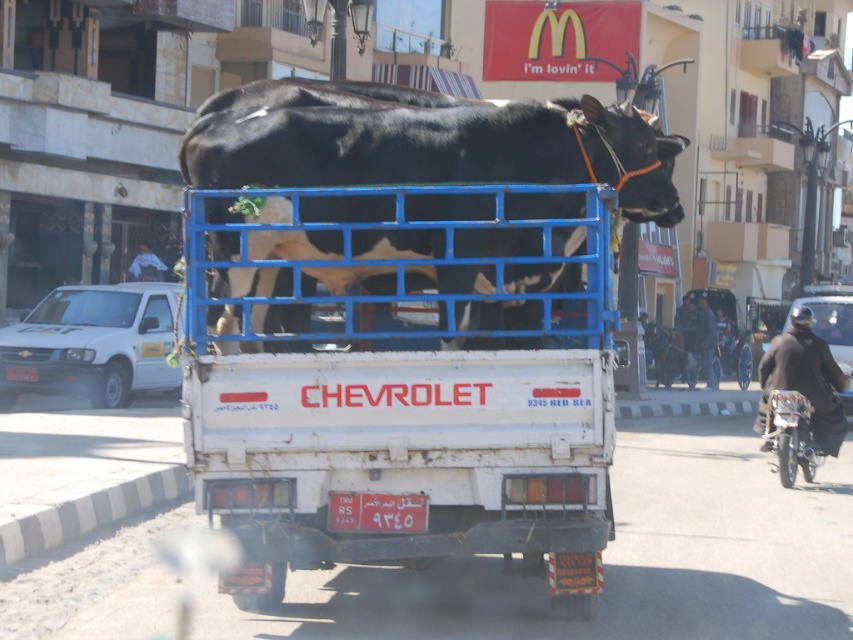
Question: Which object appears closest to the camera in this image?

Choices:
 (A) white matte truck at left
 (B) shiny black bull at center
 (C) metallic silver motorcycle at right
 (D) white matte truck at center

Answer: (D)

Question: Is white matte truck at center further to camera compared to black leather jacket at lower right?

Choices:
 (A) yes
 (B) no

Answer: (B)

Question: Which is nearer to the metallic silver motorcycle at right?

Choices:
 (A) shiny black bull at center
 (B) white matte truck at left
 (C) white matte truck at center
 (D) black leather jacket at lower right

Answer: (D)

Question: Which point is closer to the camera?

Choices:
 (A) (804, 417)
 (B) (833, 412)
 (C) (195, 224)

Answer: (C)

Question: Can you confirm if white matte truck at center is positioned to the left of shiny black bull at center?

Choices:
 (A) yes
 (B) no

Answer: (A)

Question: Can you confirm if white matte truck at left is thinner than black leather jacket at lower right?

Choices:
 (A) no
 (B) yes

Answer: (A)